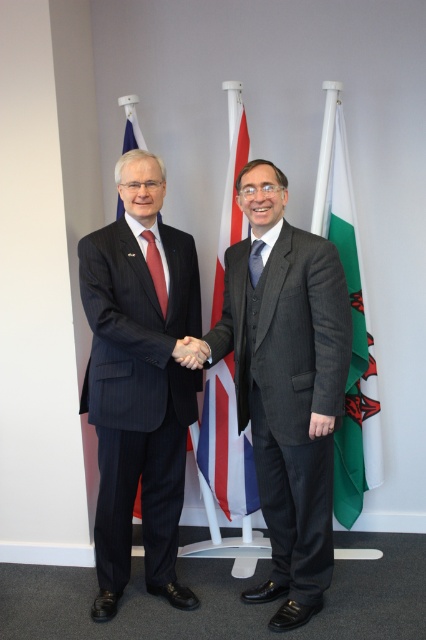
Question: Does dark blue pinstripe suit at center lie behind red and white striped flag at center?

Choices:
 (A) no
 (B) yes

Answer: (A)

Question: Among these objects, which one is farthest from the camera?

Choices:
 (A) matte red tie at center
 (B) dark blue pinstripe suit at center
 (C) green fabric flag at right
 (D) dark gray suit at center

Answer: (C)

Question: Can you confirm if red and white striped flag at center is positioned above black matte hand at center?

Choices:
 (A) yes
 (B) no

Answer: (A)

Question: Is matte red tie at center to the right of black matte hand at center from the viewer's perspective?

Choices:
 (A) yes
 (B) no

Answer: (B)

Question: Among these objects, which one is farthest from the camera?

Choices:
 (A) black matte hand at center
 (B) matte red tie at center

Answer: (B)

Question: Estimate the real-world distances between objects in this image. Which object is farther from the dark gray suit at center?

Choices:
 (A) dark blue pinstripe suit at center
 (B) red and white striped flag at center
 (C) matte red tie at center
 (D) black matte hand at center

Answer: (C)